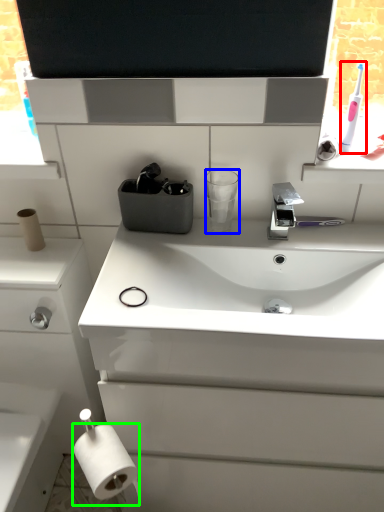
Question: Which object is positioned closest to toothbrush (highlighted by a red box)? Select from cup (highlighted by a blue box) and toilet paper (highlighted by a green box).

Choices:
 (A) cup
 (B) toilet paper

Answer: (A)